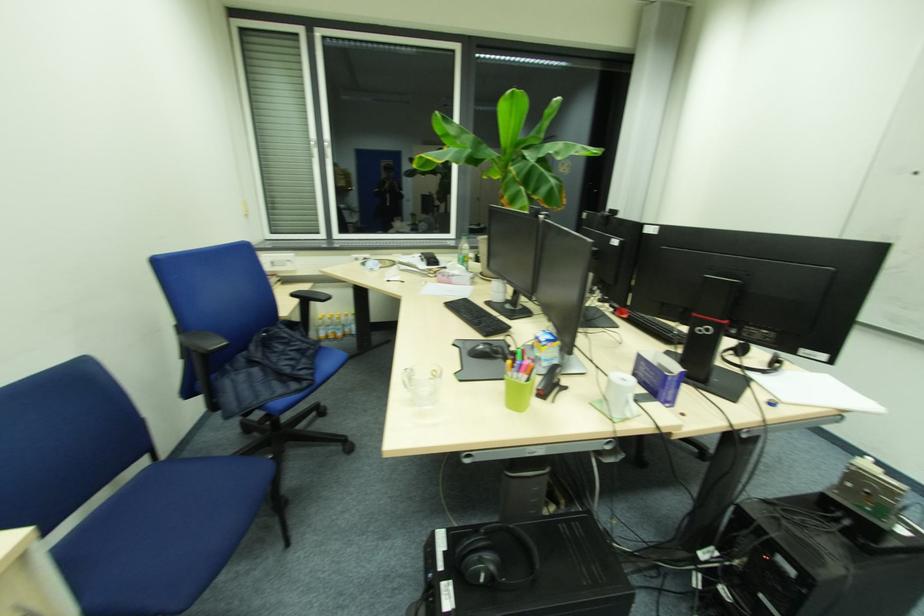
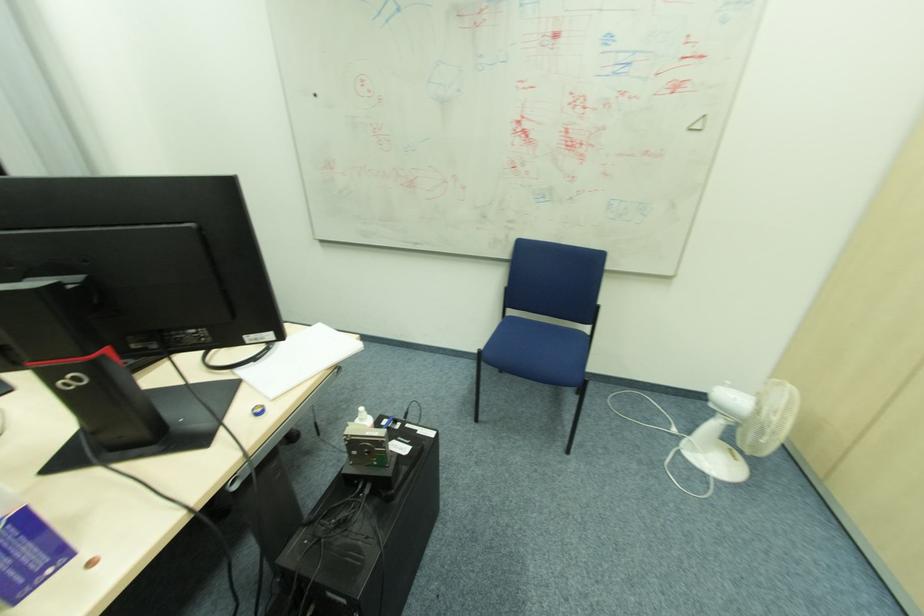
How did the camera likely rotate?

The camera rotated toward right-down.